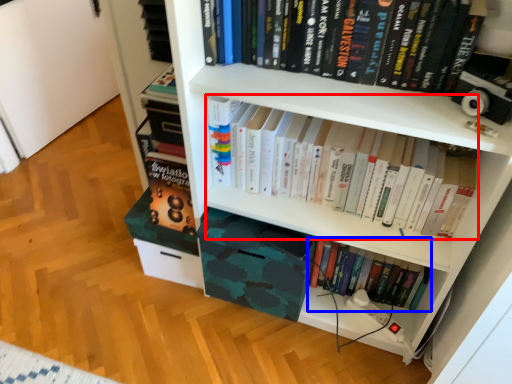
Question: Among these objects, which one is nearest to the camera, book (highlighted by a red box) or book (highlighted by a blue box)?

Choices:
 (A) book
 (B) book

Answer: (A)